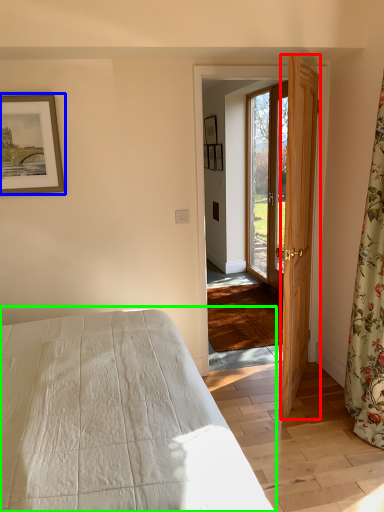
Question: Which object is positioned closest to door (highlighted by a red box)? Select from picture frame (highlighted by a blue box) and bed (highlighted by a green box).

Choices:
 (A) picture frame
 (B) bed

Answer: (B)